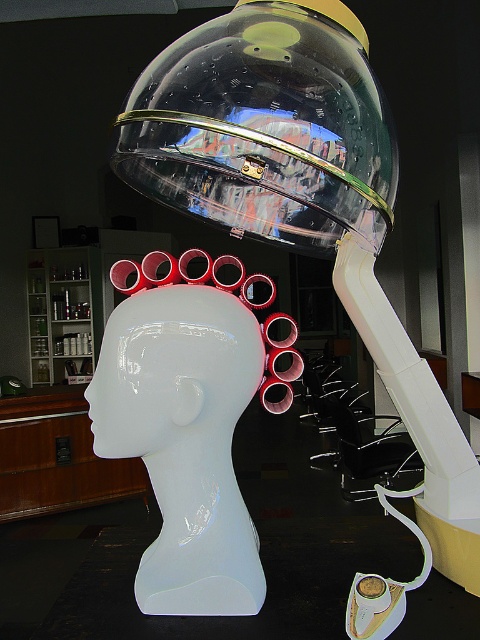
Does transparent plastic dome at upper center have a greater height compared to glossy white head at center?

Yes, transparent plastic dome at upper center is taller than glossy white head at center.

Who is more forward, (326, 77) or (224, 349)?

Point (326, 77) is in front.

Which is behind, point (358, 170) or point (240, 356)?

The point (240, 356) is more distant.

I want to click on transparent plastic dome at upper center, so click(265, 128).